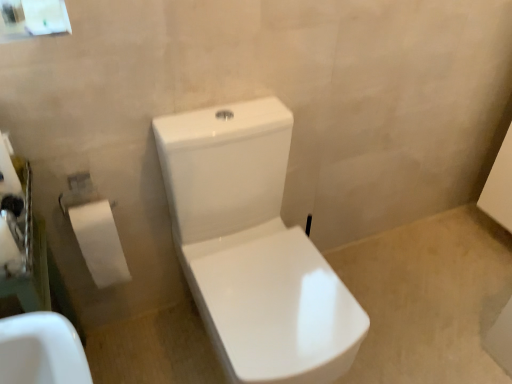
Locate an element on the screen. The width and height of the screenshot is (512, 384). vacant space to the right of white glossy toilet at center is located at coordinates (400, 322).